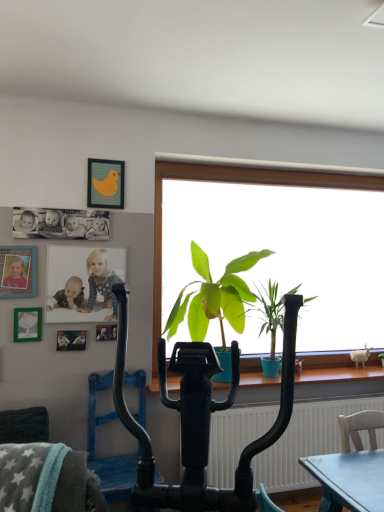
Question: Is black rubber vacuum at center at the right side of metallic silver picture frame at left, which ranks as the 4th picture frame in right-to-left order?

Choices:
 (A) yes
 (B) no

Answer: (A)

Question: Is black rubber vacuum at center outside metallic silver picture frame at left, the third picture frame positioned from the top?

Choices:
 (A) no
 (B) yes

Answer: (B)

Question: Can you see black rubber vacuum at center touching metallic silver picture frame at left, the third picture frame positioned from the top?

Choices:
 (A) no
 (B) yes

Answer: (A)

Question: Does black rubber vacuum at center have a lesser height compared to metallic silver picture frame at left, which ranks as the 4th picture frame in right-to-left order?

Choices:
 (A) yes
 (B) no

Answer: (B)

Question: Considering the relative sizes of black rubber vacuum at center and metallic silver picture frame at left, which appears as the 3th picture frame when ordered from the bottom, in the image provided, is black rubber vacuum at center smaller than metallic silver picture frame at left, which appears as the 3th picture frame when ordered from the bottom,?

Choices:
 (A) no
 (B) yes

Answer: (A)

Question: Is point (16, 276) positioned closer to the camera than point (97, 205)?

Choices:
 (A) farther
 (B) closer

Answer: (B)

Question: From a real-world perspective, is matte plastic picture frame at left, positioned as the 1th picture frame in left-to-right order, above or below matte yellow bird at upper center, which appears as the fifth picture frame when ordered from the bottom?

Choices:
 (A) above
 (B) below

Answer: (B)

Question: Considering the relative positions of matte plastic picture frame at left, acting as the 4th picture frame starting from the bottom, and matte yellow bird at upper center, which ranks as the first picture frame in top-to-bottom order, in the image provided, is matte plastic picture frame at left, acting as the 4th picture frame starting from the bottom, to the left or to the right of matte yellow bird at upper center, which ranks as the first picture frame in top-to-bottom order,?

Choices:
 (A) right
 (B) left

Answer: (B)

Question: In terms of width, does matte plastic picture frame at left, positioned as the 1th picture frame in left-to-right order, look wider or thinner when compared to matte yellow bird at upper center, which ranks as the first picture frame in top-to-bottom order?

Choices:
 (A) wide
 (B) thin

Answer: (A)

Question: Is black matte photograph at upper left inside or outside of matte white photo of children at upper left?

Choices:
 (A) inside
 (B) outside

Answer: (B)

Question: Is black matte photograph at upper left bigger or smaller than matte white photo of children at upper left?

Choices:
 (A) small
 (B) big

Answer: (A)

Question: From the image's perspective, is black matte photograph at upper left above or below matte white photo of children at upper left?

Choices:
 (A) below
 (B) above

Answer: (B)

Question: Is black matte photograph at upper left to the left or to the right of matte white photo of children at upper left in the image?

Choices:
 (A) left
 (B) right

Answer: (A)

Question: In terms of width, does metallic silver photo frame at upper left, the first picture frame positioned from the right, look wider or thinner when compared to gray plush swivel chair at lower left?

Choices:
 (A) wide
 (B) thin

Answer: (B)

Question: Looking at the image, does metallic silver photo frame at upper left, which ranks as the fourth picture frame in top-to-bottom order, seem bigger or smaller compared to gray plush swivel chair at lower left?

Choices:
 (A) big
 (B) small

Answer: (B)